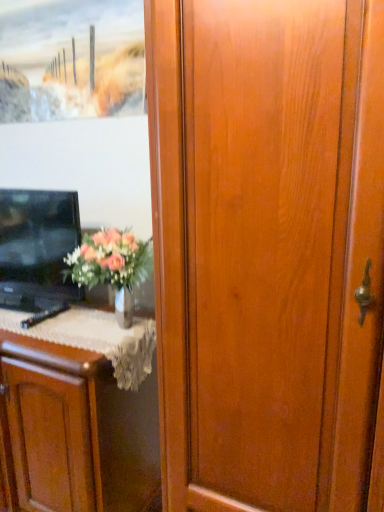
Question: Does wooden frame at upper left have a larger size compared to black glossy tv at left?

Choices:
 (A) no
 (B) yes

Answer: (A)

Question: Is wooden frame at upper left oriented away from black glossy tv at left?

Choices:
 (A) yes
 (B) no

Answer: (B)

Question: From the image's perspective, does wooden frame at upper left appear higher than black glossy tv at left?

Choices:
 (A) yes
 (B) no

Answer: (A)

Question: Is wooden frame at upper left to the right of black glossy tv at left from the viewer's perspective?

Choices:
 (A) no
 (B) yes

Answer: (B)

Question: Considering the relative sizes of wooden frame at upper left and black glossy tv at left in the image provided, is wooden frame at upper left thinner than black glossy tv at left?

Choices:
 (A) no
 (B) yes

Answer: (B)

Question: From the image's perspective, is matte wood cabinet at left located above or below wooden frame at upper left?

Choices:
 (A) above
 (B) below

Answer: (B)

Question: Relative to wooden frame at upper left, is matte wood cabinet at left in front or behind?

Choices:
 (A) behind
 (B) front

Answer: (B)

Question: From their relative heights in the image, would you say matte wood cabinet at left is taller or shorter than wooden frame at upper left?

Choices:
 (A) short
 (B) tall

Answer: (B)

Question: In terms of size, does matte wood cabinet at left appear bigger or smaller than wooden frame at upper left?

Choices:
 (A) big
 (B) small

Answer: (A)

Question: From the image's perspective, is wooden frame at upper left positioned above or below matte wood cabinet at left?

Choices:
 (A) below
 (B) above

Answer: (B)

Question: Is wooden frame at upper left inside or outside of matte wood cabinet at left?

Choices:
 (A) outside
 (B) inside

Answer: (A)

Question: Considering the relative positions of wooden frame at upper left and matte wood cabinet at left in the image provided, is wooden frame at upper left to the left or to the right of matte wood cabinet at left?

Choices:
 (A) right
 (B) left

Answer: (A)

Question: Considering the positions of point (69, 40) and point (39, 378), is point (69, 40) closer or farther from the camera than point (39, 378)?

Choices:
 (A) farther
 (B) closer

Answer: (A)

Question: Is black glossy tv at left in front of or behind wooden frame at upper left in the image?

Choices:
 (A) front
 (B) behind

Answer: (A)

Question: Visually, is black glossy tv at left positioned to the left or to the right of wooden frame at upper left?

Choices:
 (A) left
 (B) right

Answer: (A)